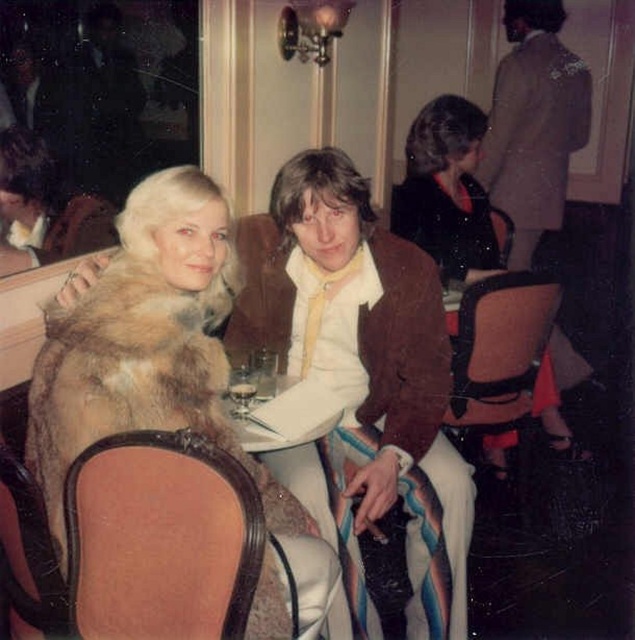
You are standing at the entrance of the room and want to locate the brown leather jacket at center. Based on the coordinates provided, in which direction should you look to find it?

The brown leather jacket at center is located at coordinates point (533, 124), which means it is positioned slightly to the left and lower part of the image from the entrance.

You are a photographer at the event and want to capture a photo of both the fur coat at left and the brown leather jacket at center. Which object should you focus on first to ensure both are in the frame?

The fur coat at left is positioned under the brown leather jacket at center, so you should focus on the brown leather jacket at center first to ensure both are in the frame.

You are a photographer standing 1.5 meters away from the fur coat at left. Can you reach it without moving your feet?

The fur coat at left is 1.36 meters away from the viewer. Since you are standing 1.5 meters away, you are slightly farther than the coat, so you cannot reach it without moving closer.